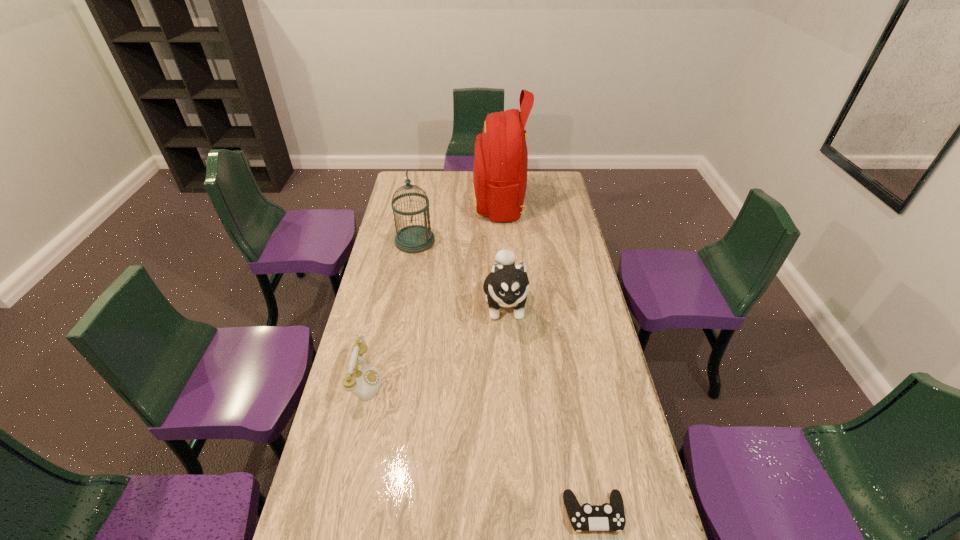
Locate an element on the screen. free space located 0.050m on the front-facing side of the tallest object is located at coordinates (463, 202).

The height and width of the screenshot is (540, 960). I want to click on free region located 0.250m on the front-facing side of the tallest object, so click(x=423, y=202).

Locate an element on the screen. The width and height of the screenshot is (960, 540). vacant space located 0.400m on the front-facing side of the tallest object is located at coordinates (394, 202).

Find the location of a particular element. free location located on the front-facing side of the birdcage is located at coordinates (450, 241).

You are a GUI agent. You are given a task and a screenshot of the screen. Output one action in this format:
    pyautogui.click(x=<x>, y=<y>)
    Task: Click on the vacant space located 0.170m at the face of the third shortest object
    The height and width of the screenshot is (540, 960).
    Given the screenshot: What is the action you would take?
    pyautogui.click(x=510, y=376)

You are a GUI agent. You are given a task and a screenshot of the screen. Output one action in this format:
    pyautogui.click(x=<x>, y=<y>)
    Task: Click on the vacant space positioned on the dial of the telephone
    
    Given the screenshot: What is the action you would take?
    pyautogui.click(x=477, y=381)

Locate an element on the screen. object that is at the far edge is located at coordinates (500, 167).

The height and width of the screenshot is (540, 960). Identify the location of birdcage present at the left edge. (416, 238).

Locate an element on the screen. The image size is (960, 540). telephone positioned at the left edge is located at coordinates (365, 382).

What are the coordinates of `object located at the right edge` in the screenshot? It's located at (610, 516).